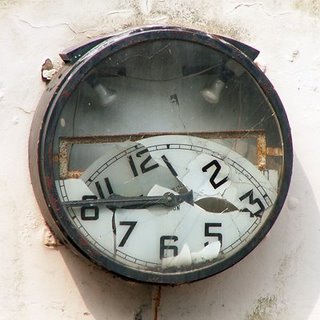
Where is `clock hands`? The width and height of the screenshot is (320, 320). clock hands is located at coordinates (159, 200).